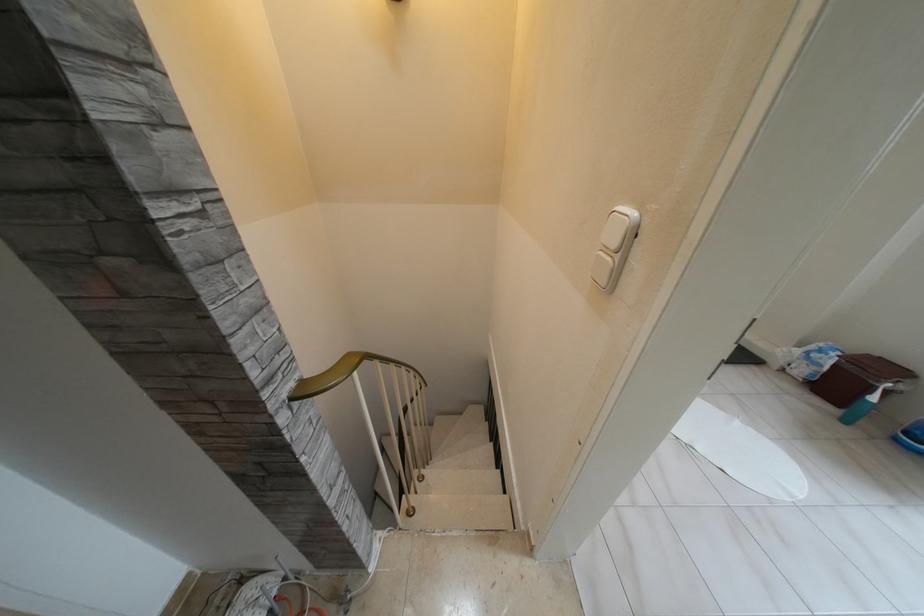
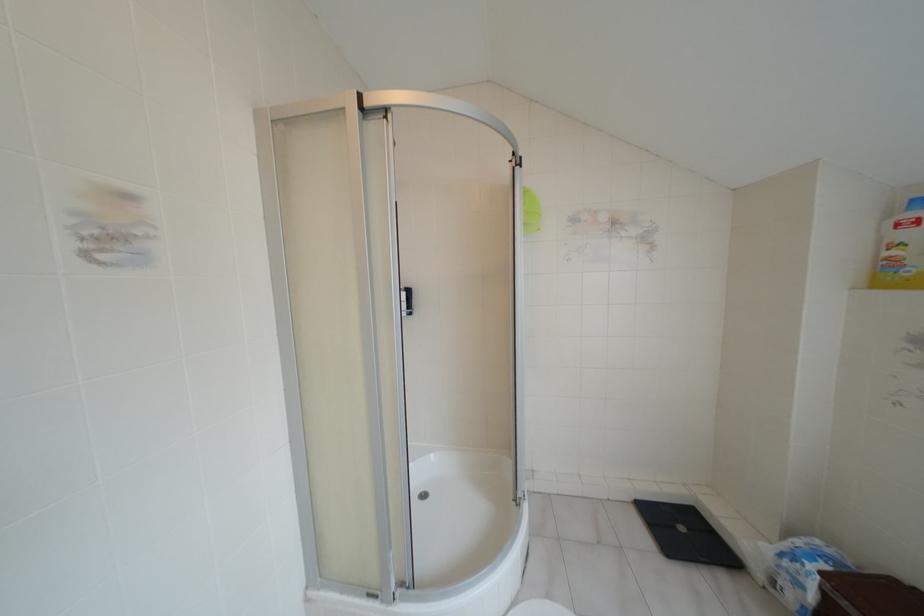
In the second image, find the point that corresponds to (x=833, y=353) in the first image.

(809, 565)